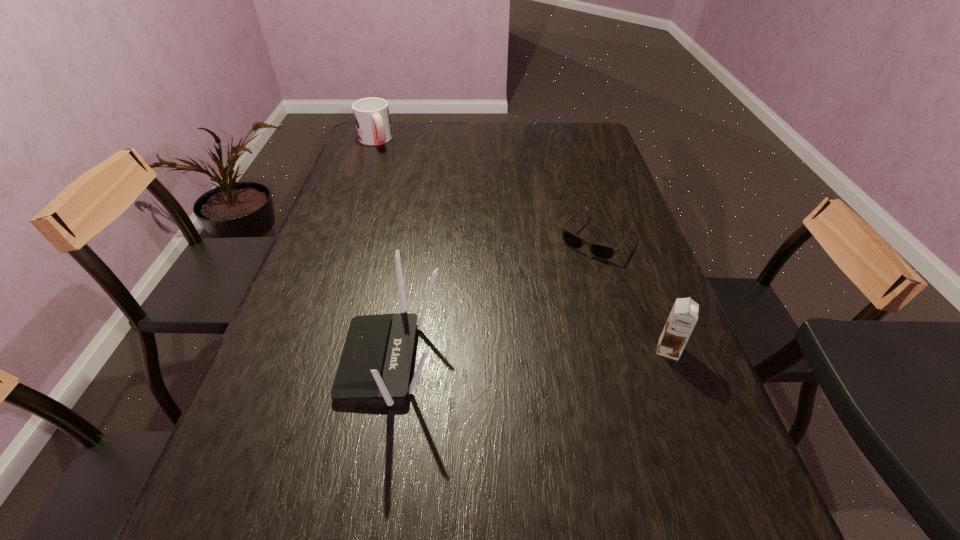
Identify the location of free space on the desktop that is between the tallest object and the chocolate milk and is positioned on the side of the mug with the handle. (515, 355).

This screenshot has width=960, height=540. Identify the location of vacant spot on the desktop that is between the second object from left to right and the chocolate milk and is positioned on the lenses of the shortest object. (506, 355).